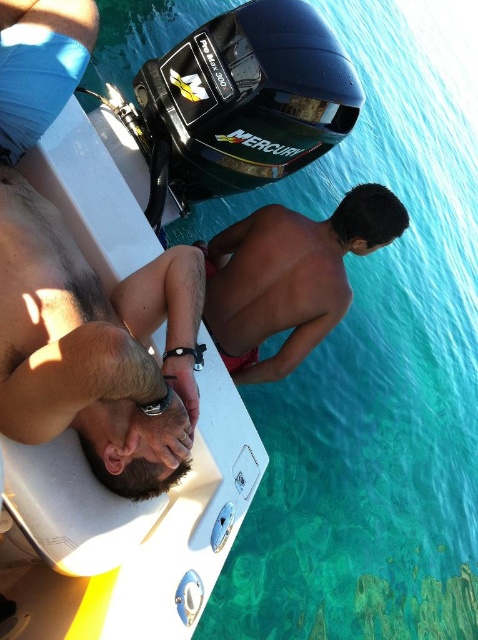
Consider the image. You are standing on the deck of the boat and want to locate the smooth skin man at lower left. According to the coordinates given, where would you find him?

The smooth skin man at lower left is located at coordinates point (96, 348).

You are standing on a dock and see the white plastic boat at upper center anchored in the turquoise sea. If you want to reach the boat using a 7.5 feet long rope, will the rope be sufficient to reach it?

The white plastic boat at upper center is 6.80 feet away from the viewer. Since the rope is 7.5 feet long, which is longer than the distance, the rope will be sufficient to reach the boat.